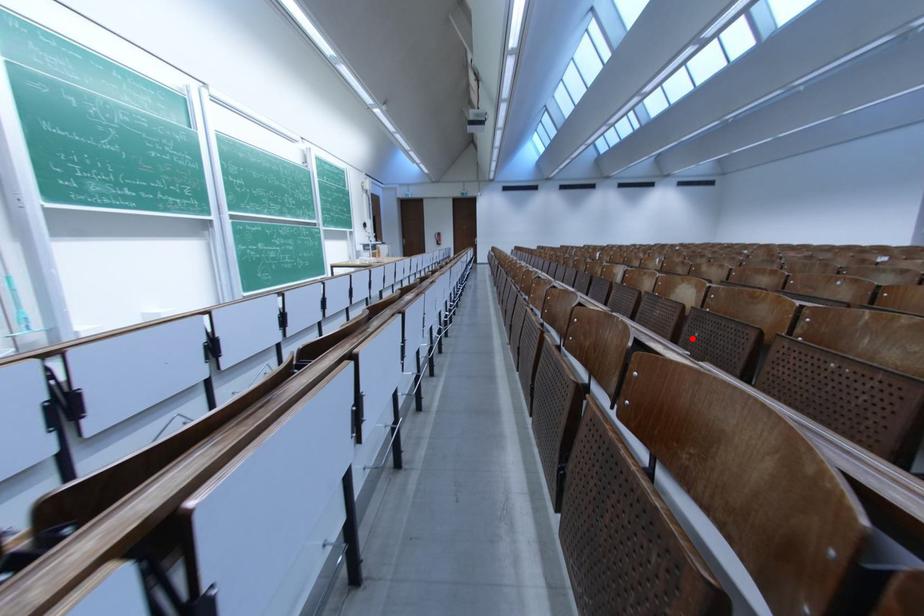
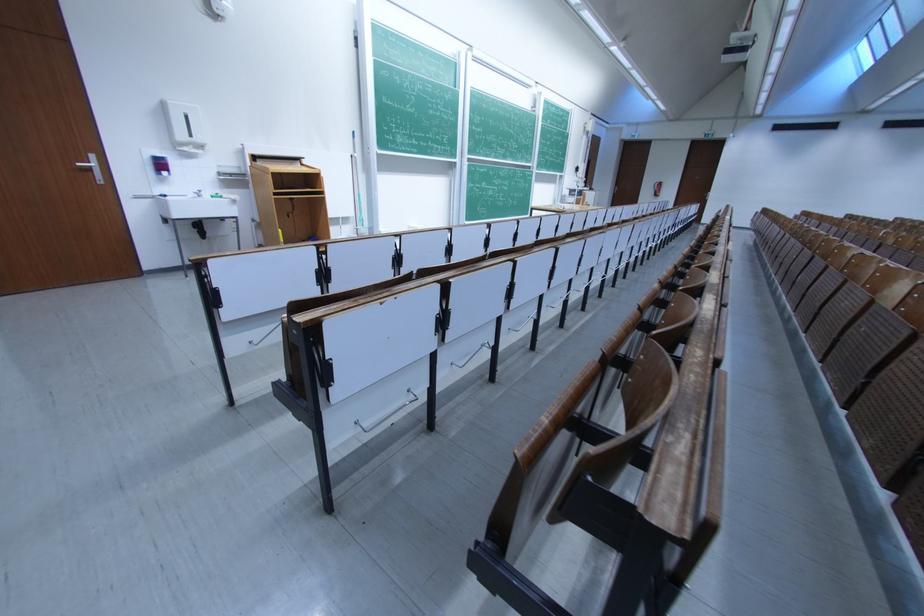
Question: I am providing you with two images of the same scene from different viewpoints. Image1 has a red point marked. In image2, the corresponding 3D location appears at what relative position? Reply with the corresponding letter.

Choices:
 (A) Closer
 (B) Farther

Answer: (B)